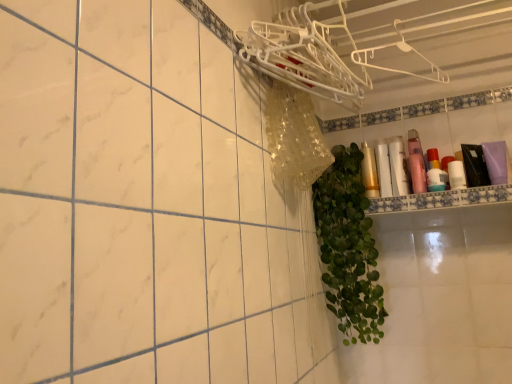
Question: Should I look upward or downward to see white glossy shelf at upper right?

Choices:
 (A) up
 (B) down

Answer: (B)

Question: Is white glossy shelf at upper right positioned far away from white glossy bottle at upper right, which ranks as the 3th toiletry in left-to-right order?

Choices:
 (A) yes
 (B) no

Answer: (B)

Question: Considering the relative positions of white glossy shelf at upper right and white glossy bottle at upper right, which ranks as the 3th toiletry in left-to-right order, in the image provided, is white glossy shelf at upper right to the left of white glossy bottle at upper right, which ranks as the 3th toiletry in left-to-right order, from the viewer's perspective?

Choices:
 (A) yes
 (B) no

Answer: (B)

Question: Does white glossy shelf at upper right have a lesser height compared to white glossy bottle at upper right, which ranks as the 3th toiletry in left-to-right order?

Choices:
 (A) yes
 (B) no

Answer: (A)

Question: From the image's perspective, is white glossy shelf at upper right over white glossy bottle at upper right, which ranks as the 3th toiletry in left-to-right order?

Choices:
 (A) no
 (B) yes

Answer: (A)

Question: Is white glossy shelf at upper right next to white glossy bottle at upper right, acting as the 3th toiletry starting from the right, and touching it?

Choices:
 (A) yes
 (B) no

Answer: (B)

Question: Is white glossy shelf at upper right facing towards white glossy bottle at upper right, which ranks as the 3th toiletry in left-to-right order?

Choices:
 (A) yes
 (B) no

Answer: (B)

Question: Are pink matte bottle at upper right, the 4th toiletry viewed from the left, and matte gold tube at upper right, which is the 4th toiletry from right to left, located far from each other?

Choices:
 (A) no
 (B) yes

Answer: (A)

Question: Is pink matte bottle at upper right, placed as the 2th toiletry when sorted from right to left, not within matte gold tube at upper right, which is the 4th toiletry from right to left?

Choices:
 (A) yes
 (B) no

Answer: (A)

Question: Does pink matte bottle at upper right, the 4th toiletry viewed from the left, appear on the left side of matte gold tube at upper right, which is the 2th toiletry in left-to-right order?

Choices:
 (A) yes
 (B) no

Answer: (B)

Question: Does pink matte bottle at upper right, placed as the 2th toiletry when sorted from right to left, have a lesser width compared to matte gold tube at upper right, which is the 4th toiletry from right to left?

Choices:
 (A) yes
 (B) no

Answer: (B)

Question: Is pink matte bottle at upper right, placed as the 2th toiletry when sorted from right to left, further to the viewer compared to matte gold tube at upper right, which is the 4th toiletry from right to left?

Choices:
 (A) no
 (B) yes

Answer: (A)

Question: Is matte gold tube at upper right, which is the 2th toiletry in left-to-right order, at the back of pink matte bottle at upper right, the 4th toiletry viewed from the left?

Choices:
 (A) no
 (B) yes

Answer: (A)

Question: Is white glossy bottle at upper right, which ranks as the 3th toiletry in left-to-right order, next to translucent plastic bottles at upper right, the 1th toiletry in the right-to-left sequence, and touching it?

Choices:
 (A) yes
 (B) no

Answer: (B)